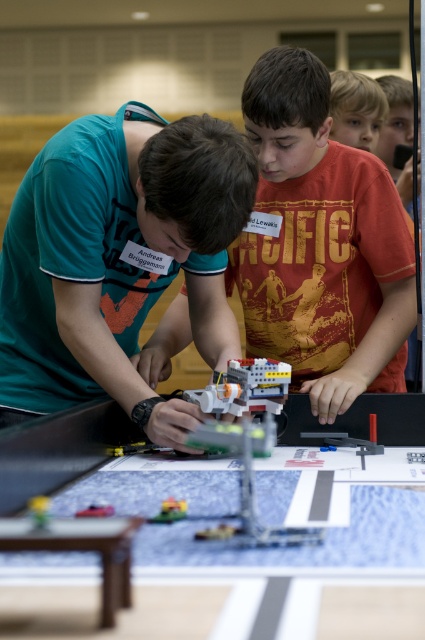
Between point (246, 100) and point (263, 376), which one is positioned in front?

Point (263, 376) is more forward.

This screenshot has width=425, height=640. Find the location of `matte orange t-shirt at center`. matte orange t-shirt at center is located at coordinates (320, 244).

Between matte orange t-shirt at center and translucent plastic toy at lower left, which one appears on the right side from the viewer's perspective?

From the viewer's perspective, matte orange t-shirt at center appears more on the right side.

Between point (325, 275) and point (39, 509), which one is positioned behind?

Point (325, 275)

At what (x,y) coordinates should I click in order to perform the action: click on matte orange t-shirt at center. Please return your answer as a coordinate pair (x, y). The width and height of the screenshot is (425, 640). Looking at the image, I should click on pos(320,244).

Does matte green shirt at center have a greater height compared to translucent plastic toy car at center?

Indeed, matte green shirt at center has a greater height compared to translucent plastic toy car at center.

Does point (20, 237) come in front of point (166, 500)?

No.

Does point (90, 269) come in front of point (172, 509)?

No, (90, 269) is further to viewer.

This screenshot has height=640, width=425. In order to click on matte green shirt at center in this screenshot , I will do `click(116, 252)`.